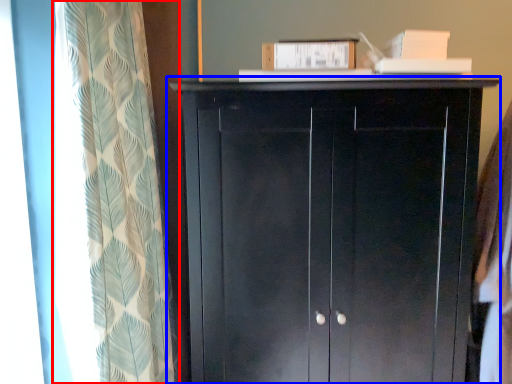
Question: Which object appears closest to the camera in this image, curtain (highlighted by a red box) or cupboard (highlighted by a blue box)?

Choices:
 (A) curtain
 (B) cupboard

Answer: (A)